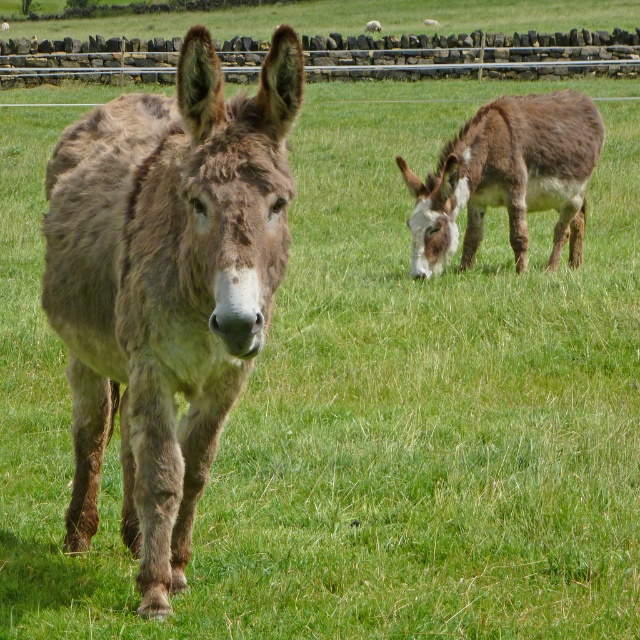
Question: Which point is closer to the camera taking this photo?

Choices:
 (A) (531, 177)
 (B) (152, 49)

Answer: (A)

Question: Estimate the real-world distances between objects in this image. Which object is closer to the brushed metal fence at upper center?

Choices:
 (A) brown fuzzy mule at right
 (B) brown fuzzy donkey at center

Answer: (A)

Question: Where is brown fuzzy donkey at center located in relation to brown fuzzy mule at right in the image?

Choices:
 (A) left
 (B) right

Answer: (A)

Question: Is brown fuzzy donkey at center in front of brown fuzzy mule at right?

Choices:
 (A) yes
 (B) no

Answer: (A)

Question: Which point is farther to the camera?

Choices:
 (A) brown fuzzy donkey at center
 (B) brushed metal fence at upper center
 (C) brown fuzzy mule at right

Answer: (C)

Question: Is brown fuzzy donkey at center to the right of brushed metal fence at upper center from the viewer's perspective?

Choices:
 (A) no
 (B) yes

Answer: (B)